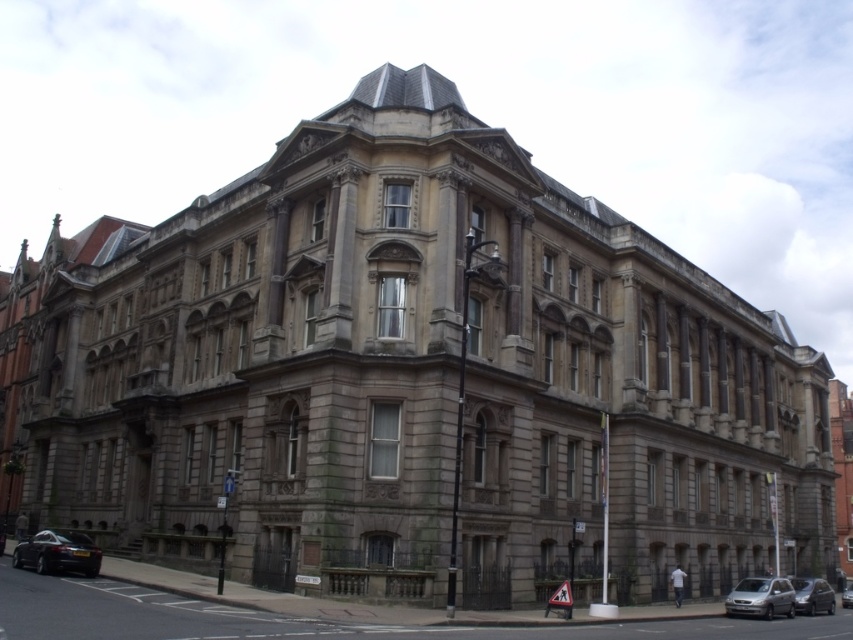
You are standing in front of a historic building and see a shiny black car at lower left. If you want to take a photo of the entire building without the car in the frame, which direction should you move? The camera is at your eye level.

You should move to the right because the shiny black car at lower left is located to your left side. By moving right, you can position yourself away from the car and capture the building without it in the frame.

You are a pedestrian standing on the sidewalk in front of the grand historic building. You see a silver metallic van at lower right and a metallic silver car at lower right. Which vehicle is closer to you?

The silver metallic van at lower right is closer to you because it is in front of the metallic silver car at lower right.

You are standing in front of the historic building and notice two points marked on its facade. The first point is at coordinates point (68,570) and the second is at point (851,595). Which of these two points is closer to your current position?

Point (68,570) is closer to the camera than point (851,595).